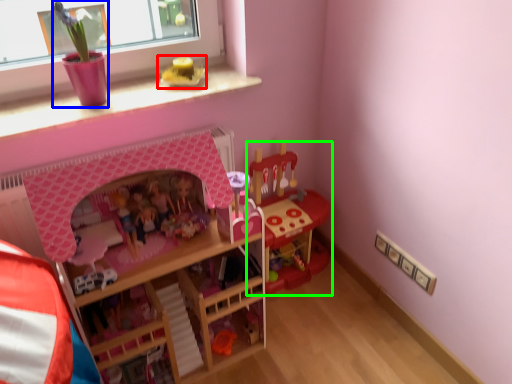
Question: Which is farther away from toy (highlighted by a red box)? toy (highlighted by a blue box) or toy (highlighted by a green box)?

Choices:
 (A) toy
 (B) toy

Answer: (B)